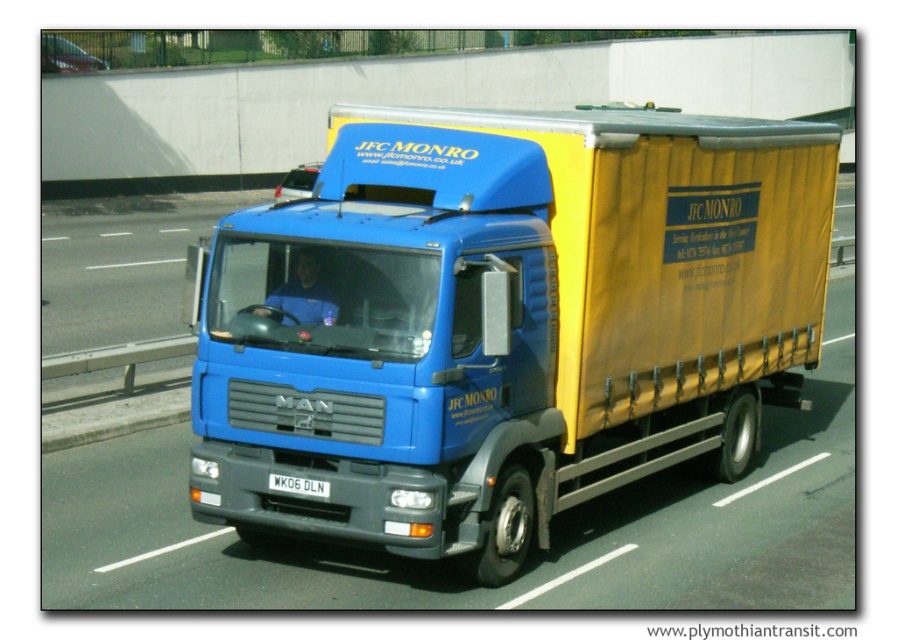
You are a traffic officer observing a blue matte truck at center with a white plastic license plate at center. Which object is larger in the image?

The blue matte truck at center is bigger than the white plastic license plate at center.

You are a traffic officer checking license plates. You see the blue matte truck at center and the white plastic license plate at center. Can you clearly read the license plate text from your current position?

The blue matte truck at center is positioned over white plastic license plate at center, so the license plate text cannot be clearly read from this position.